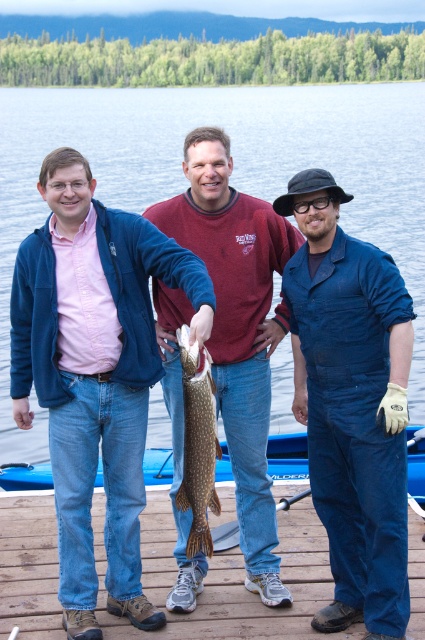
Question: Can you confirm if clear blue water at center is wider than wooden dock at lower center?

Choices:
 (A) no
 (B) yes

Answer: (B)

Question: Estimate the real-world distances between objects in this image. Which object is farther from the wooden dock at lower center?

Choices:
 (A) shiny silver fish at center
 (B) blue plastic boat at lower center

Answer: (B)

Question: Does matte brown fish at center come in front of shiny silver fish at center?

Choices:
 (A) yes
 (B) no

Answer: (B)

Question: Which point appears closest to the camera in this image?

Choices:
 (A) (204, 412)
 (B) (218, 472)

Answer: (A)

Question: Which of the following is the closest to the observer?

Choices:
 (A) blue denim overalls at center
 (B) shiny silver fish at center
 (C) clear blue water at center
 (D) matte brown fish at center

Answer: (B)

Question: Can you confirm if matte brown fish at center is positioned above blue plastic boat at lower center?

Choices:
 (A) yes
 (B) no

Answer: (A)